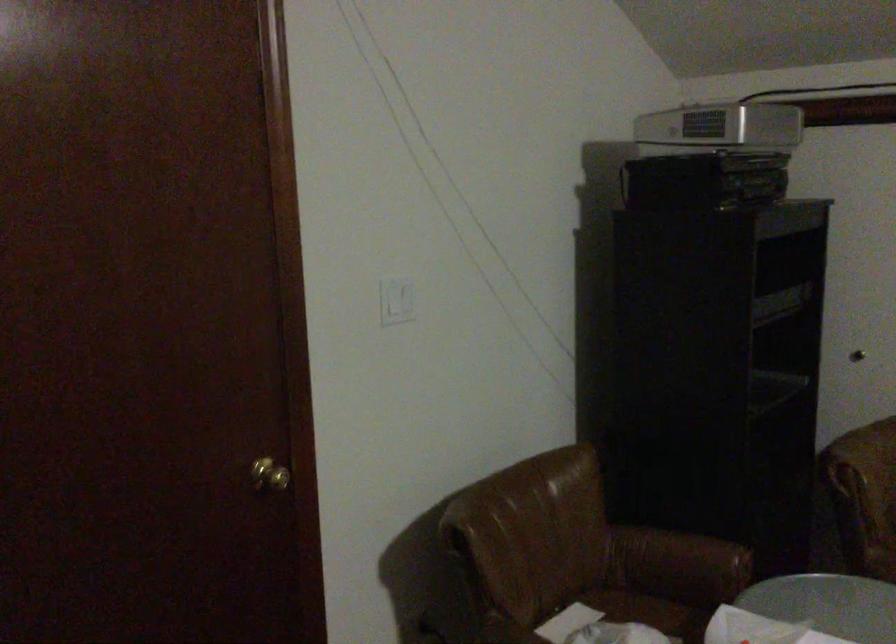
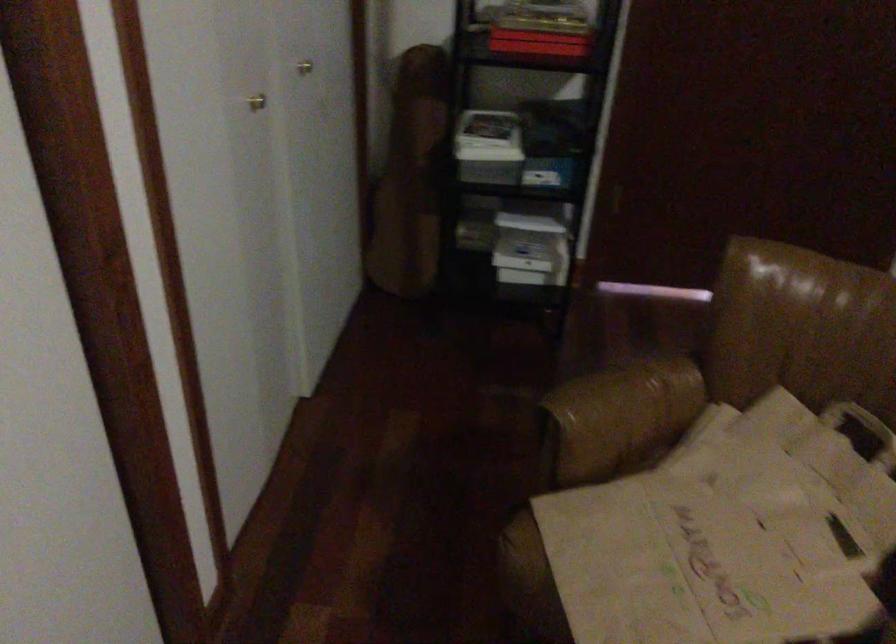
In the scene shown: Based on the continuous images, in which direction is the camera rotating?

The camera rotated toward left-down.